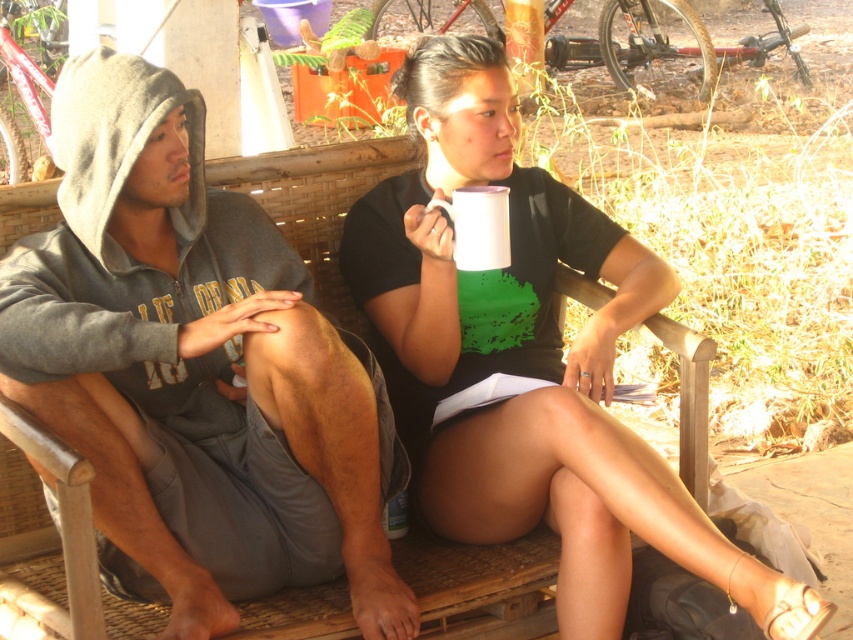
You are a photographer setting up a tripod to take a group photo of the two people sitting on the woven bamboo bench. The tripod has a height adjustment feature. You want to ensure that both the gray fleece hoodie at left and the white matte cup at center are clearly visible in the photo. Considering their heights, what should you do with the tripod?

Since the gray fleece hoodie at left is not as tall as the white matte cup at center, you should adjust the tripod to a lower height to ensure both are visible without one blocking the other.

You are standing in an outdoor area and see the gray fleece hoodie at left. If you want to reach out and touch it, will you be able to do so without moving closer?

The gray fleece hoodie at left is 1.84 meters away from you, so you cannot reach it without moving closer since the average human arm length is about 0.7 meters.

You are standing in the park and see a gray fleece hoodie at left and a black top with green design at right. A point with coordinates [195,371] is marked in the image. Which object is this point located on?

The point with coordinates [195,371] is located on the gray fleece hoodie at left according to the description.